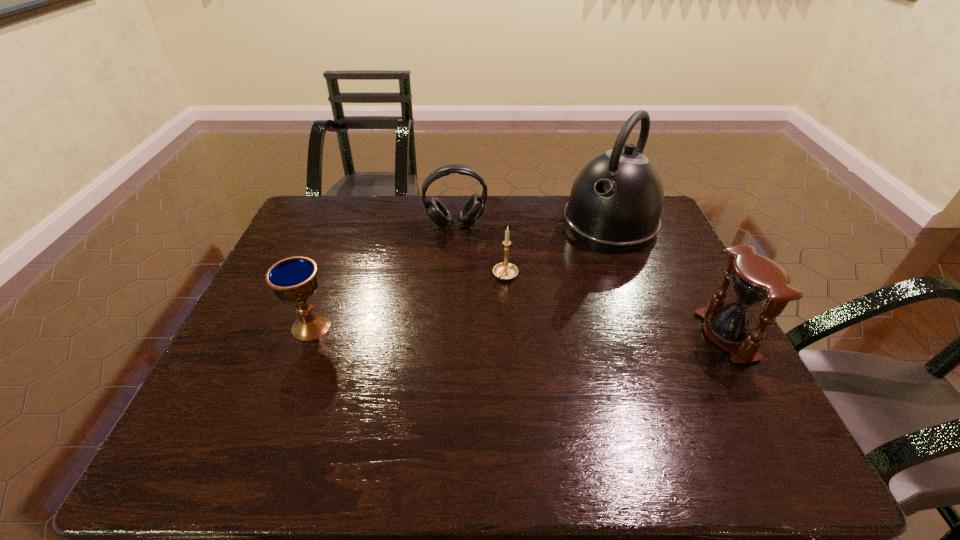
The width and height of the screenshot is (960, 540). Identify the location of free space between the third object from left to right and the fourth object from right to left. (481, 250).

Image resolution: width=960 pixels, height=540 pixels. In order to click on unoccupied position between the hourglass and the tallest object in this screenshot , I will do `click(668, 280)`.

Image resolution: width=960 pixels, height=540 pixels. Identify the location of free space between the second object from left to right and the third nearest object. (481, 250).

You are a GUI agent. You are given a task and a screenshot of the screen. Output one action in this format:
    pyautogui.click(x=<x>, y=<y>)
    Task: Click on the free space between the kettle and the third nearest object
    This screenshot has width=960, height=540.
    Given the screenshot: What is the action you would take?
    pyautogui.click(x=558, y=250)

You are a GUI agent. You are given a task and a screenshot of the screen. Output one action in this format:
    pyautogui.click(x=<x>, y=<y>)
    Task: Click on the free spot between the tallest object and the second object from left to right
    
    Given the screenshot: What is the action you would take?
    pyautogui.click(x=533, y=224)

Locate an element on the screen. Image resolution: width=960 pixels, height=540 pixels. vacant area that lies between the fourth object from right to left and the chalice is located at coordinates (384, 275).

Find the location of a particular element. The width and height of the screenshot is (960, 540). free space between the third farthest object and the tallest object is located at coordinates (558, 250).

Where is `free space between the kettle and the headset`? free space between the kettle and the headset is located at coordinates (533, 224).

Locate which object is the closest to the hourglass. Please provide its 2D coordinates. Your answer should be formatted as a tuple, i.e. [(x, y)], where the tuple contains the x and y coordinates of a point satisfying the conditions above.

[(615, 204)]

Locate an element on the screen. Image resolution: width=960 pixels, height=540 pixels. object that stands as the third closest to the tallest object is located at coordinates (473, 208).